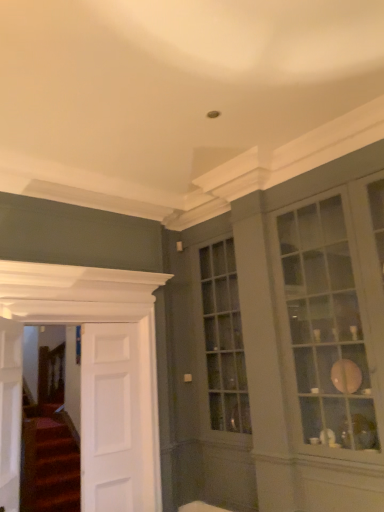
Question: From the image's perspective, is white wooden door at left, which is counted as the second door, starting from the left, located above or below white smooth door at left, which is counted as the 1th door, starting from the right?

Choices:
 (A) above
 (B) below

Answer: (A)

Question: Considering the positions of white wooden door at left, placed as the second door when sorted from right to left, and white smooth door at left, which is counted as the 1th door, starting from the right, in the image, is white wooden door at left, placed as the second door when sorted from right to left, bigger or smaller than white smooth door at left, which is counted as the 1th door, starting from the right,?

Choices:
 (A) big
 (B) small

Answer: (A)

Question: Which object is positioned farthest from the matte glass cabinet at right?

Choices:
 (A) white wooden door at left, which is counted as the second door, starting from the left
 (B) white smooth door at left, which is counted as the 1th door, starting from the right
 (C) white wooden door at left, marked as the 3th door in a right-to-left arrangement

Answer: (C)

Question: Which object is positioned closest to the white wooden door at left, placed as the second door when sorted from right to left?

Choices:
 (A) white smooth door at left, acting as the third door starting from the left
 (B) matte glass cabinet at right
 (C) white wooden door at left, placed as the first door when sorted from left to right

Answer: (A)